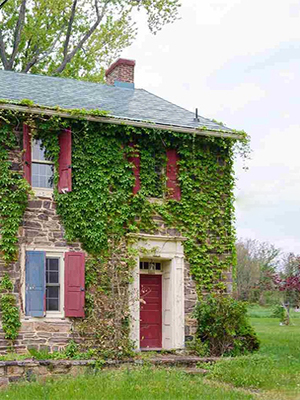
Where is `brick wall`? The image size is (300, 400). brick wall is located at coordinates (76, 365).